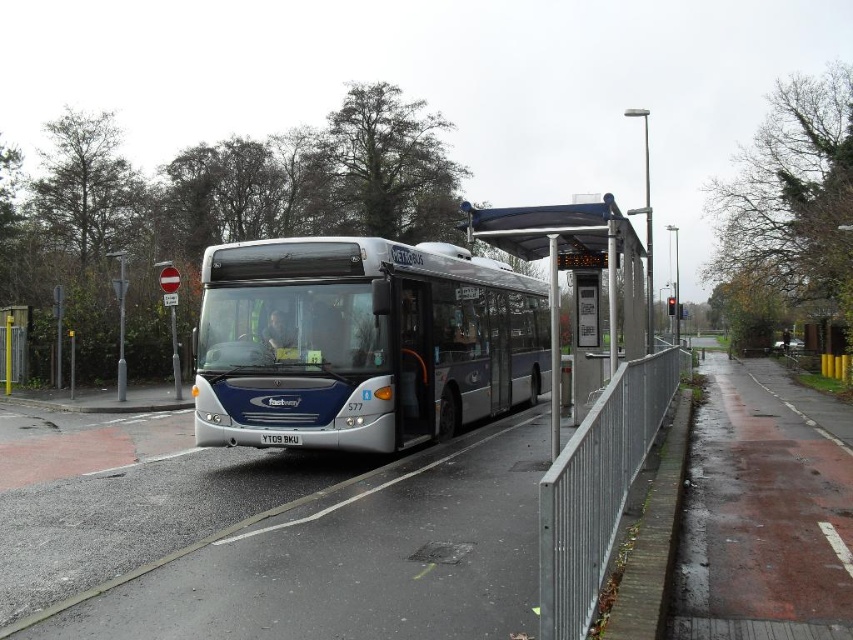
You are a pedestrian standing at the bus stop. You need to cross the road to reach the silver metallic fence at right. Which side of the silver metallic bus at center should you walk around to get to the fence?

You should walk around the right side of the silver metallic bus at center to reach the silver metallic fence at right since the bus is to the left of the fence.

Consider the image. You are a delivery person with a cart that is 1.2 meters wide. You need to pass through the space between the silver metallic fence at right and the transparent plastic bus stop at center. Can your cart fit through the space?

The silver metallic fence at right might be wider than transparent plastic bus stop at center, but the exact width isn t specified. Without knowing the exact dimensions, it s uncertain if the cart will fit. Please check the actual space before proceeding.

You are a delivery person with a cart that is 2 feet wide. You need to move your cart between the silver metallic bus at center and the transparent plastic bus stop at center. Can you fit your cart through the space between them?

The distance between the silver metallic bus at center and the transparent plastic bus stop at center is 6.67 feet, which is wider than your cart of 2 feet. Therefore, you can fit your cart through the space between them.